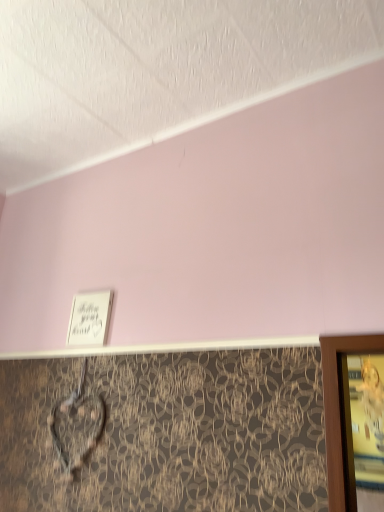
Image resolution: width=384 pixels, height=512 pixels. What do you see at coordinates (90, 318) in the screenshot?
I see `white paper at upper left` at bounding box center [90, 318].

At what (x,y) coordinates should I click in order to perform the action: click on white paper at upper left. Please return your answer as a coordinate pair (x, y). Looking at the image, I should click on (90, 318).

The height and width of the screenshot is (512, 384). What are the coordinates of `white paper at upper left` in the screenshot? It's located at (90, 318).